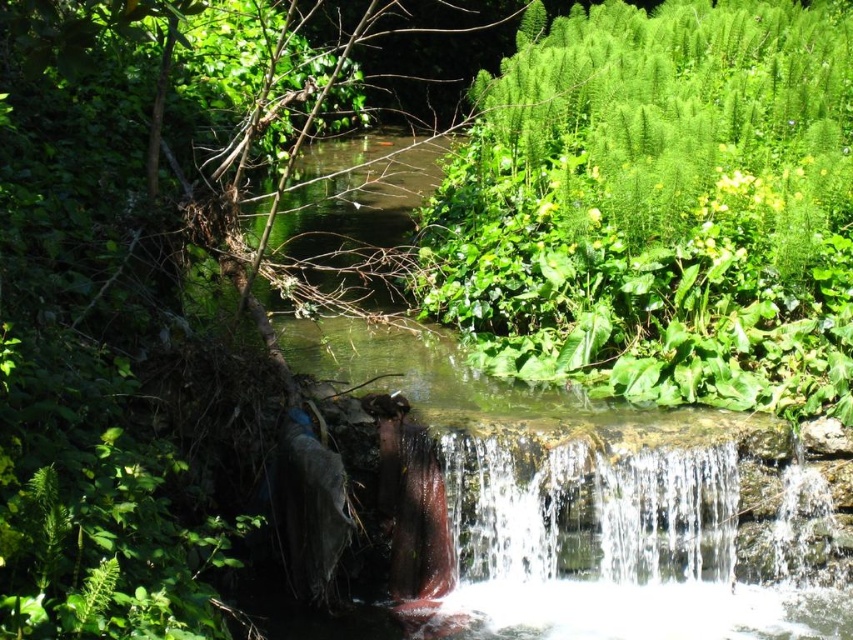
Can you confirm if green leafy plant at upper right is thinner than clear water at center?

Correct, green leafy plant at upper right's width is less than clear water at center's.

Is point (814, 148) behind point (656, 531)?

Yes, it is.

Find the location of a particular element. Image resolution: width=853 pixels, height=640 pixels. green leafy plant at upper right is located at coordinates (660, 208).

Does green mossy rock at center have a greater width compared to clear water at center?

Yes.

Does point (526, 424) lie in front of point (596, 426)?

Yes, it is.

Is point (515, 456) closer to viewer compared to point (496, 436)?

Yes, point (515, 456) is in front of point (496, 436).

Locate an element on the screen. The image size is (853, 640). green mossy rock at center is located at coordinates (589, 499).

How distant is green leafy plant at upper right from green mossy rock at center?

3.07 meters

Between point (476, 323) and point (379, 630), which one is positioned behind?

Point (476, 323)

Find the location of a particular element. green leafy plant at upper right is located at coordinates (660, 208).